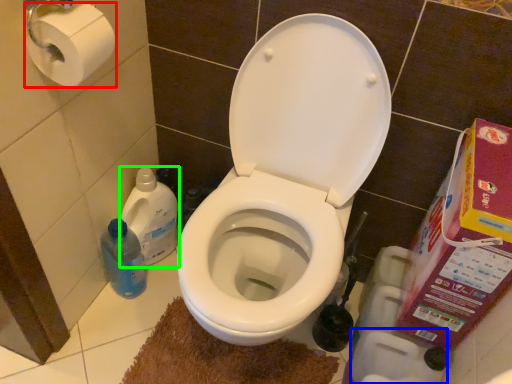
Question: Estimate the real-world distances between objects in this image. Which object is closer to toilet paper (highlighted by a red box), toilet paper (highlighted by a blue box) or cleaning product (highlighted by a green box)?

Choices:
 (A) toilet paper
 (B) cleaning product

Answer: (B)